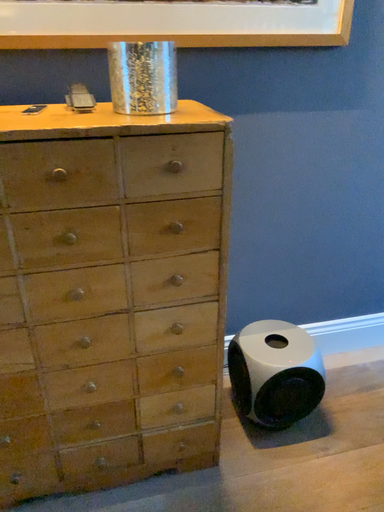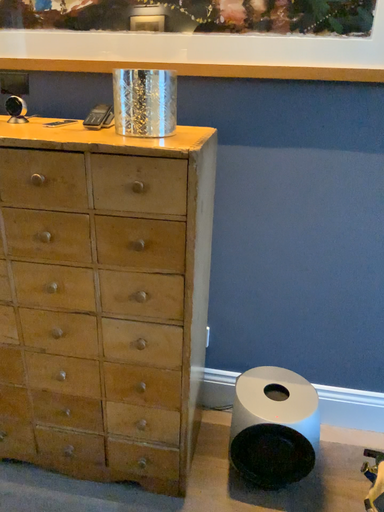
Question: Which way did the camera rotate in the video?

Choices:
 (A) rotated left
 (B) rotated right

Answer: (A)